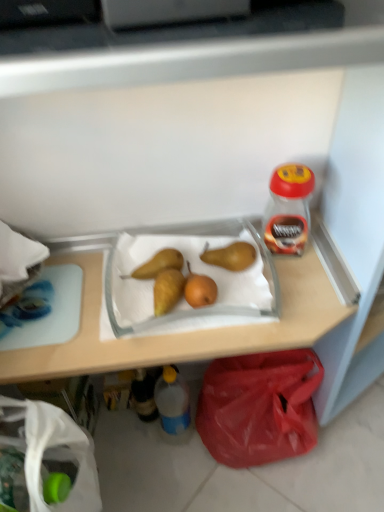
Question: From a real-world perspective, does translucent plastic bottle at lower center, which ranks as the 1th bottle in left-to-right order, stand above white fabric bag at lower left?

Choices:
 (A) yes
 (B) no

Answer: (B)

Question: Considering the relative positions of translucent plastic bottle at lower center, which ranks as the second bottle in bottom-to-top order, and white fabric bag at lower left in the image provided, is translucent plastic bottle at lower center, which ranks as the second bottle in bottom-to-top order, behind white fabric bag at lower left?

Choices:
 (A) no
 (B) yes

Answer: (B)

Question: Is translucent plastic bottle at lower center, which ranks as the 1th bottle in left-to-right order, oriented towards white fabric bag at lower left?

Choices:
 (A) yes
 (B) no

Answer: (B)

Question: Could white fabric bag at lower left be considered to be inside translucent plastic bottle at lower center, which ranks as the 1th bottle in left-to-right order?

Choices:
 (A) no
 (B) yes

Answer: (A)

Question: Is translucent plastic bottle at lower center, the 2th bottle from the top, thinner than white fabric bag at lower left?

Choices:
 (A) yes
 (B) no

Answer: (A)

Question: In terms of size, does red plastic bag at lower right appear bigger or smaller than translucent plastic bottle at lower center, the 3th bottle positioned from the right?

Choices:
 (A) small
 (B) big

Answer: (B)

Question: Is red plastic bag at lower right wider or thinner than translucent plastic bottle at lower center, which ranks as the second bottle in bottom-to-top order?

Choices:
 (A) wide
 (B) thin

Answer: (A)

Question: From their relative heights in the image, would you say red plastic bag at lower right is taller or shorter than translucent plastic bottle at lower center, the 2th bottle from the top?

Choices:
 (A) short
 (B) tall

Answer: (B)

Question: Is red plastic bag at lower right in front of or behind translucent plastic bottle at lower center, which ranks as the 1th bottle in left-to-right order, in the image?

Choices:
 (A) front
 (B) behind

Answer: (A)

Question: Looking at their shapes, would you say brown matte pear at center, marked as the 1th pear in a left-to-right arrangement, is wider or thinner than white fabric bag at lower left?

Choices:
 (A) wide
 (B) thin

Answer: (B)

Question: Is brown matte pear at center, marked as the 1th pear in a left-to-right arrangement, inside or outside of white fabric bag at lower left?

Choices:
 (A) inside
 (B) outside

Answer: (B)

Question: From a real-world perspective, relative to white fabric bag at lower left, is brown matte pear at center, positioned as the second pear in right-to-left order, vertically above or below?

Choices:
 (A) above
 (B) below

Answer: (A)

Question: Considering their positions, is brown matte pear at center, positioned as the second pear in right-to-left order, located in front of or behind white fabric bag at lower left?

Choices:
 (A) front
 (B) behind

Answer: (B)

Question: Which is correct: brown matte pear at center, marked as the 1th pear in a left-to-right arrangement, is inside blue translucent bottle at lower center, which is the third bottle in top-to-bottom order, or outside of it?

Choices:
 (A) inside
 (B) outside

Answer: (B)

Question: Looking at their shapes, would you say brown matte pear at center, positioned as the second pear in right-to-left order, is wider or thinner than blue translucent bottle at lower center, which ranks as the 2th bottle in left-to-right order?

Choices:
 (A) wide
 (B) thin

Answer: (A)